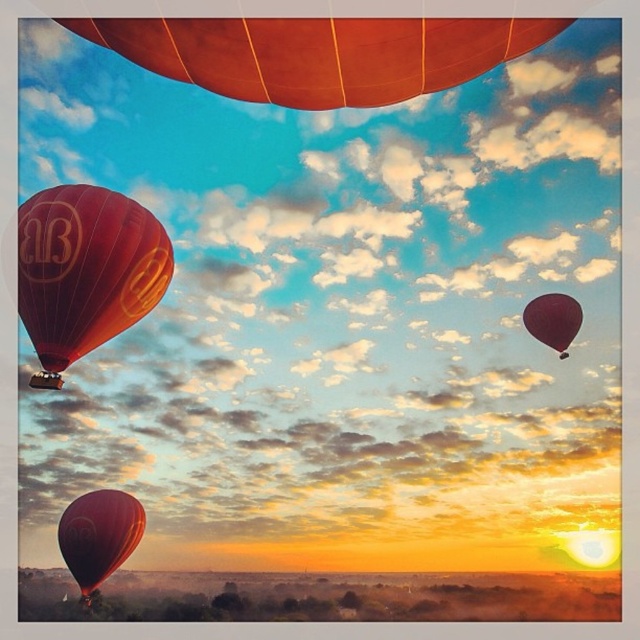
Question: Considering the real-world distances, which object is closest to the matte orange balloon at upper center?

Choices:
 (A) matte dark red balloon at upper right
 (B) matte red hot air balloon at left
 (C) matte red hot air balloon at lower left

Answer: (B)

Question: Which object is the farthest from the matte dark red balloon at upper right?

Choices:
 (A) matte orange balloon at upper center
 (B) matte red hot air balloon at lower left

Answer: (A)

Question: Is matte red hot air balloon at left smaller than matte dark red balloon at upper right?

Choices:
 (A) yes
 (B) no

Answer: (B)

Question: Is matte orange balloon at upper center thinner than matte dark red balloon at upper right?

Choices:
 (A) yes
 (B) no

Answer: (B)

Question: Observing the image, what is the correct spatial positioning of matte orange balloon at upper center in reference to matte red hot air balloon at lower left?

Choices:
 (A) left
 (B) right

Answer: (B)

Question: Considering the real-world distances, which object is farthest from the matte orange balloon at upper center?

Choices:
 (A) matte red hot air balloon at left
 (B) matte red hot air balloon at lower left
 (C) matte dark red balloon at upper right

Answer: (C)